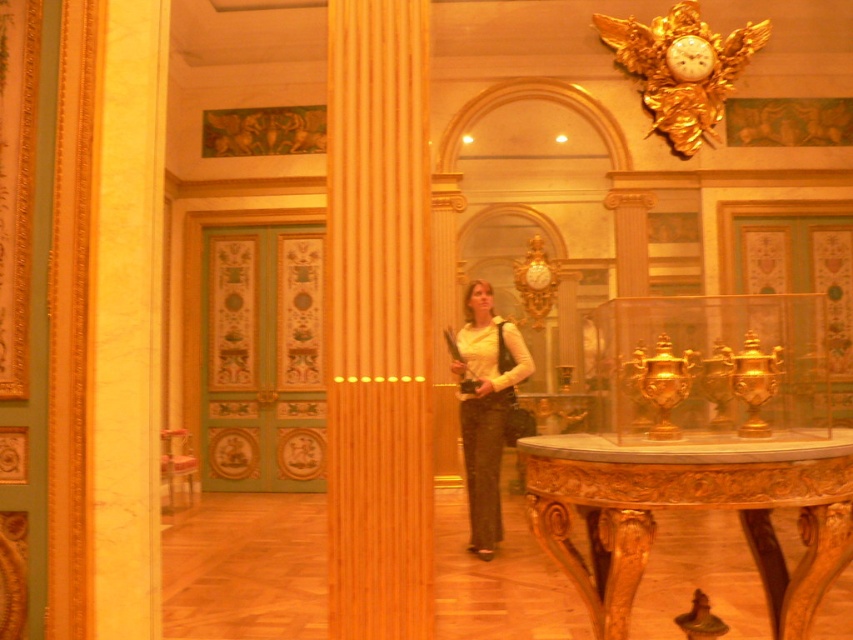
Question: Observing the image, what is the correct spatial positioning of gold carved table at center in reference to white matte shirt at center?

Choices:
 (A) above
 (B) below

Answer: (B)

Question: Which point is closer to the camera?

Choices:
 (A) gold metallic clock at upper center
 (B) smooth wood pillar at center
 (C) white matte shirt at center

Answer: (B)

Question: Does gold carved table at center appear over gold metallic clock at upper center?

Choices:
 (A) yes
 (B) no

Answer: (B)

Question: Which point appears farthest from the camera in this image?

Choices:
 (A) (477, 344)
 (B) (686, 42)

Answer: (B)

Question: Which of these objects is positioned closest to the smooth wood pillar at center?

Choices:
 (A) gold metallic clock at upper center
 (B) gold carved table at center
 (C) white matte shirt at center

Answer: (B)

Question: Can you confirm if gold carved table at center is bigger than white matte shirt at center?

Choices:
 (A) yes
 (B) no

Answer: (A)